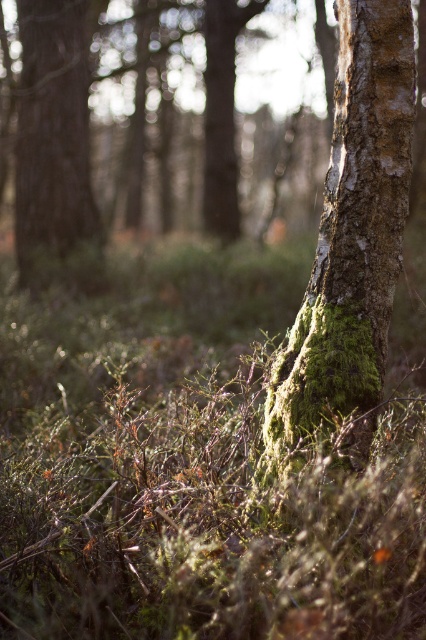
You are a botanist examining the forest scene. You notice the green mossy grass at center. Based on its position, can you determine if it is closer to the front or the back of the image?

The green mossy grass at center is located at point (195,461), which places it centrally in the image. However, since the scene describes the foreground as having dense undergrowth, the mossy grass at center is likely positioned midground, between the foreground undergrowth and the tree trunk, so it is not the closest to the front but still relatively near the front of the image.

You are a photographer trying to capture the green mossy grass at center and the green mossy bark at center in a single shot. Which object should you focus on first to ensure both are in sharp focus?

You should focus on the green mossy bark at center first because it is farther away from the viewer than the green mossy grass at center, ensuring both are in focus when using depth of field properly.